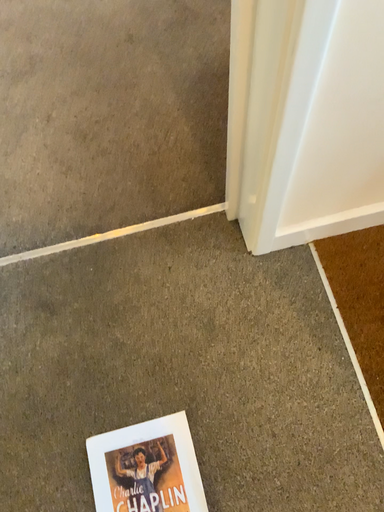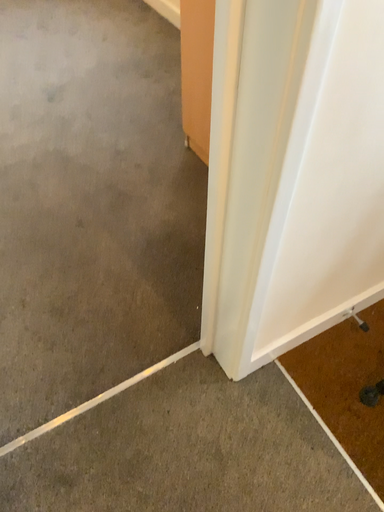
Question: How did the camera likely rotate when shooting the video?

Choices:
 (A) rotated left
 (B) rotated right

Answer: (B)